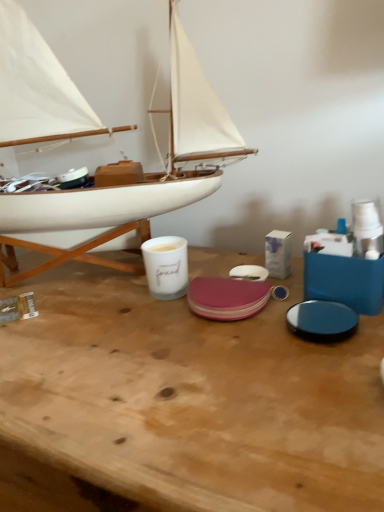
The image size is (384, 512). I want to click on free space above wooden table at center (from a real-world perspective), so click(142, 317).